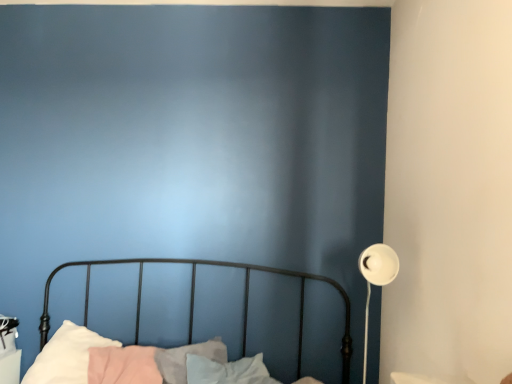
Question: Should I look upward or downward to see metallic black bed at lower left?

Choices:
 (A) down
 (B) up

Answer: (A)

Question: Considering the relative sizes of white matte floor lamp at right and metallic black bed at lower left in the image provided, is white matte floor lamp at right thinner than metallic black bed at lower left?

Choices:
 (A) no
 (B) yes

Answer: (B)

Question: Does white matte floor lamp at right have a lesser height compared to metallic black bed at lower left?

Choices:
 (A) yes
 (B) no

Answer: (A)

Question: Considering the relative sizes of white matte floor lamp at right and metallic black bed at lower left in the image provided, is white matte floor lamp at right taller than metallic black bed at lower left?

Choices:
 (A) no
 (B) yes

Answer: (A)

Question: Are white matte floor lamp at right and metallic black bed at lower left making contact?

Choices:
 (A) no
 (B) yes

Answer: (A)

Question: Is white matte floor lamp at right closer to camera compared to metallic black bed at lower left?

Choices:
 (A) yes
 (B) no

Answer: (B)

Question: Does white matte floor lamp at right come behind metallic black bed at lower left?

Choices:
 (A) yes
 (B) no

Answer: (A)

Question: From a real-world perspective, is metallic black bed at lower left over white matte floor lamp at right?

Choices:
 (A) yes
 (B) no

Answer: (B)

Question: From the image's perspective, does metallic black bed at lower left appear lower than white matte floor lamp at right?

Choices:
 (A) no
 (B) yes

Answer: (B)

Question: Is metallic black bed at lower left next to white matte floor lamp at right?

Choices:
 (A) no
 (B) yes

Answer: (A)

Question: Is metallic black bed at lower left oriented away from white matte floor lamp at right?

Choices:
 (A) no
 (B) yes

Answer: (A)

Question: Does metallic black bed at lower left have a lesser height compared to white matte floor lamp at right?

Choices:
 (A) no
 (B) yes

Answer: (A)

Question: From the image's perspective, would you say metallic black bed at lower left is positioned over white matte floor lamp at right?

Choices:
 (A) no
 (B) yes

Answer: (A)

Question: From their relative heights in the image, would you say metallic black bed at lower left is taller or shorter than white matte floor lamp at right?

Choices:
 (A) short
 (B) tall

Answer: (B)